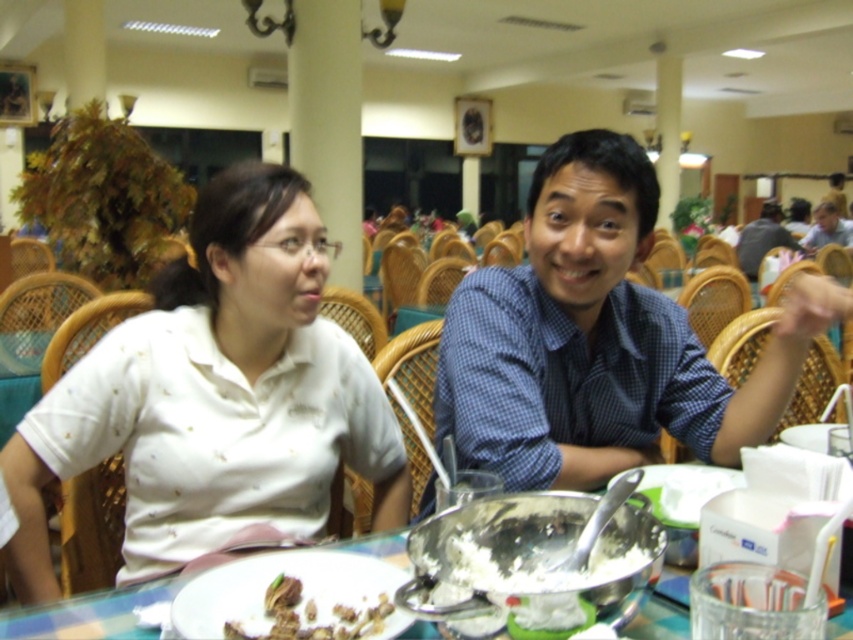
Question: Is the position of blue checkered shirt at center more distant than that of white creamy bowl at center?

Choices:
 (A) no
 (B) yes

Answer: (B)

Question: Estimate the real-world distances between objects in this image. Which object is farther from the brown crumbly cake at lower center?

Choices:
 (A) blue checkered shirt at center
 (B) matte blue shirt at center
 (C) white creamy bowl at center

Answer: (B)

Question: Which is farther from the plastic table at center?

Choices:
 (A) matte blue shirt at center
 (B) brown crumbly cake at lower center
 (C) white matte shirt at center
 (D) white creamy bowl at center

Answer: (A)

Question: Based on their relative distances, which object is nearer to the plastic table at center?

Choices:
 (A) white creamy bowl at center
 (B) brown crumbly cake at lower center
 (C) matte blue shirt at center
 (D) white matte shirt at center

Answer: (B)

Question: Does blue checkered shirt at center appear under plastic table at center?

Choices:
 (A) yes
 (B) no

Answer: (B)

Question: Does white creamy bowl at center appear under matte blue shirt at center?

Choices:
 (A) no
 (B) yes

Answer: (B)